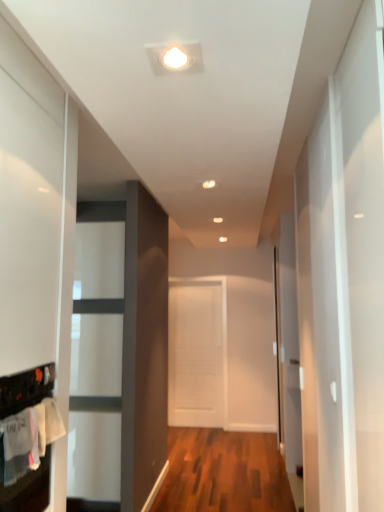
At what (x,y) coordinates should I click in order to perform the action: click on transparent glass door at right. Please return your answer as a coordinate pair (x, y). The height and width of the screenshot is (512, 384). Looking at the image, I should click on (287, 357).

This screenshot has width=384, height=512. What do you see at coordinates (29, 438) in the screenshot? I see `white cotton laundry at lower left` at bounding box center [29, 438].

I want to click on white cotton laundry at lower left, so click(29, 438).

The image size is (384, 512). What do you see at coordinates (195, 354) in the screenshot?
I see `white matte door at center` at bounding box center [195, 354].

Where is `transparent glass door at right`? transparent glass door at right is located at coordinates (287, 357).

Which of these two, transparent glass door at right or white matte door at center, is smaller?

Smaller between the two is white matte door at center.

Is transparent glass door at right taller than white matte door at center?

Yes, transparent glass door at right is taller than white matte door at center.

Is transparent glass door at right turned away from white matte door at center?

No, transparent glass door at right's orientation is not away from white matte door at center.

From a real-world perspective, who is located higher, transparent glass door at right or white matte door at center?

transparent glass door at right.

Is white matte door at center completely or partially outside of transparent glass door at right?

Yes, white matte door at center is located beyond the bounds of transparent glass door at right.

Does point (189, 288) appear closer or farther from the camera than point (288, 269)?

Clearly, point (189, 288) is more distant from the camera than point (288, 269).

Can you tell me how much white matte door at center and transparent glass door at right differ in facing direction?

91.1 degrees separate the facing orientations of white matte door at center and transparent glass door at right.

Measure the distance between white matte door at center and transparent glass door at right.

A distance of 1.18 meters exists between white matte door at center and transparent glass door at right.

In the image, is white matte door at center positioned in front of or behind white cotton laundry at lower left?

Clearly, white matte door at center is behind white cotton laundry at lower left.

Is white matte door at center inside or outside of white cotton laundry at lower left?

white matte door at center is not inside white cotton laundry at lower left, it's outside.

Considering the points (212, 410) and (48, 411), which point is behind, point (212, 410) or point (48, 411)?

The point (212, 410) is behind.

Is transparent glass door at right not within white cotton laundry at lower left?

transparent glass door at right is positioned outside white cotton laundry at lower left.

How different are the orientations of transparent glass door at right and white cotton laundry at lower left in degrees?

The angle between the facing direction of transparent glass door at right and the facing direction of white cotton laundry at lower left is 179 degrees.

Is transparent glass door at right aimed at white cotton laundry at lower left?

No, transparent glass door at right is not facing towards white cotton laundry at lower left.

Does point (294, 309) appear closer or farther from the camera than point (43, 404)?

Point (294, 309).

Between white cotton laundry at lower left and transparent glass door at right, which one appears on the right side from the viewer's perspective?

Positioned to the right is transparent glass door at right.

Where is `glass door behind the white cotton laundry at lower left`? This screenshot has height=512, width=384. glass door behind the white cotton laundry at lower left is located at coordinates click(287, 357).

Is white cotton laundry at lower left inside or outside of transparent glass door at right?

white cotton laundry at lower left is outside transparent glass door at right.

Who is taller, white cotton laundry at lower left or transparent glass door at right?

transparent glass door at right.

Is white cotton laundry at lower left far from white matte door at center?

Yes.

Between point (27, 425) and point (222, 349), which one is positioned behind?

Point (222, 349)

Does white cotton laundry at lower left turn towards white matte door at center?

No, white cotton laundry at lower left is not aimed at white matte door at center.

From a real-world perspective, who is located higher, white cotton laundry at lower left or white matte door at center?

From a 3D spatial view, white cotton laundry at lower left is above.

I want to click on glass door above the white matte door at center (from a real-world perspective), so click(287, 357).

This screenshot has height=512, width=384. Find the location of `glass door that appears on the right of white matte door at center`. glass door that appears on the right of white matte door at center is located at coordinates (287, 357).

Based on their spatial positions, is white cotton laundry at lower left or white matte door at center further from transparent glass door at right?

white cotton laundry at lower left is positioned further to the anchor transparent glass door at right.

Which object lies further to the anchor point white cotton laundry at lower left, white matte door at center or transparent glass door at right?

Among the two, white matte door at center is located further to white cotton laundry at lower left.

Estimate the real-world distances between objects in this image. Which object is closer to white matte door at center, transparent glass door at right or white cotton laundry at lower left?

The object closer to white matte door at center is transparent glass door at right.

Estimate the real-world distances between objects in this image. Which object is closer to white matte door at center, white cotton laundry at lower left or transparent glass door at right?

Among the two, transparent glass door at right is located nearer to white matte door at center.

Estimate the real-world distances between objects in this image. Which object is closer to transparent glass door at right, white matte door at center or white cotton laundry at lower left?

white matte door at center is closer to transparent glass door at right.

Which object lies nearer to the anchor point white cotton laundry at lower left, transparent glass door at right or white matte door at center?

transparent glass door at right lies closer to white cotton laundry at lower left than the other object.

Where is `glass door between white cotton laundry at lower left and white matte door at center in the front-back direction`? The height and width of the screenshot is (512, 384). glass door between white cotton laundry at lower left and white matte door at center in the front-back direction is located at coordinates (287, 357).